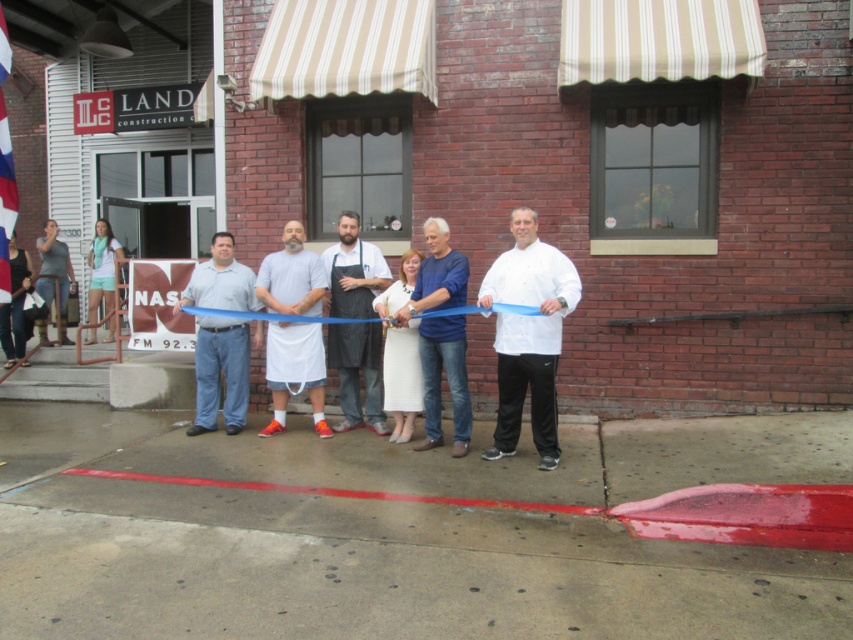
You are organizing a photo shoot and need to arrange two models wearing the white matte chef coat at center and the gray cotton shirt at center. Based on the scene description, which model should stand in front to ensure both are visible in the photo?

The white matte chef coat at center is taller than the gray cotton shirt at center, so the model wearing the gray cotton shirt at center should stand in front to ensure both are visible.

You are a photographer at the ribbon cutting ceremony. You need to take a photo of the white matte chef coat at center and the white fabric apron at center. Which one will appear larger in the photo?

The white matte chef coat at center will appear larger in the photo because it has a larger size compared to the white fabric apron at center.

You are attending a ribbon cutting ceremony and notice two white items at the center of the scene. The items are a white matte chef coat at center and a white fabric apron at center. Which item is closer to the ground?

The white matte chef coat at center is positioned under the white fabric apron at center, so the chef coat is closer to the ground.